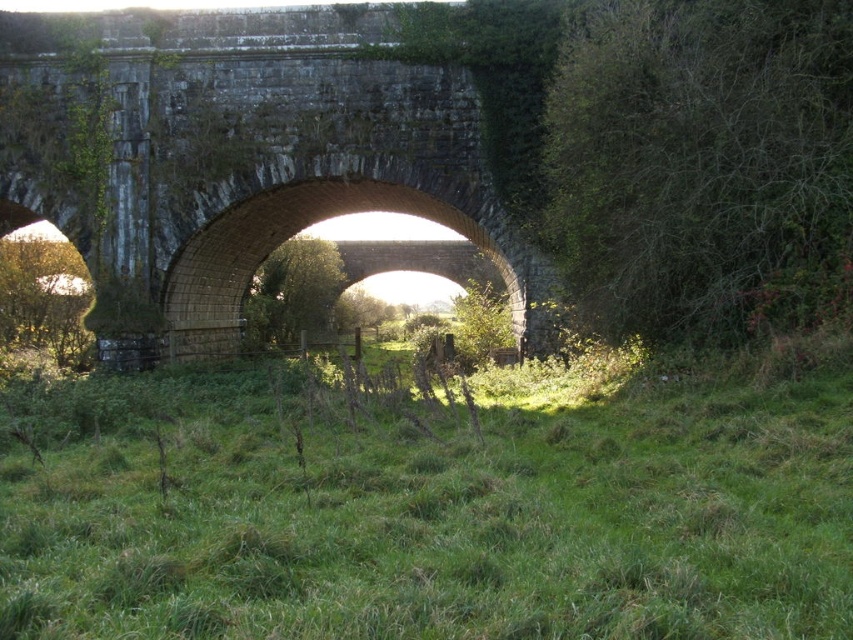
Is green grassy field at center bigger than dark gray stone bridge at center?

No, green grassy field at center is not bigger than dark gray stone bridge at center.

Does green grassy field at center appear on the right side of dark gray stone bridge at center?

Yes, green grassy field at center is to the right of dark gray stone bridge at center.

The width and height of the screenshot is (853, 640). I want to click on green grassy field at center, so click(433, 502).

The width and height of the screenshot is (853, 640). Identify the location of green grassy field at center. (433, 502).